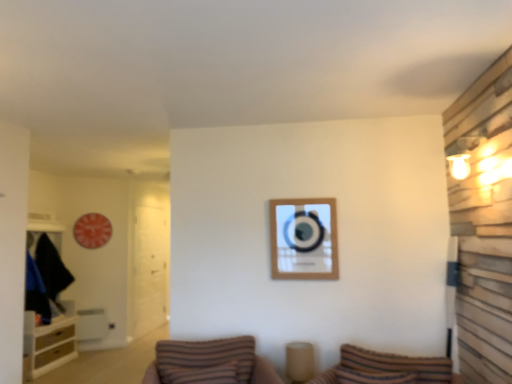
Question: Does brown striped pillow at center have a greater width compared to striped fabric pillow at lower center?

Choices:
 (A) no
 (B) yes

Answer: (B)

Question: Is brown striped pillow at center to the right of striped fabric pillow at lower center from the viewer's perspective?

Choices:
 (A) yes
 (B) no

Answer: (B)

Question: Does brown striped pillow at center appear on the left side of striped fabric pillow at lower center?

Choices:
 (A) yes
 (B) no

Answer: (A)

Question: From a real-world perspective, is brown striped pillow at center physically above striped fabric pillow at lower center?

Choices:
 (A) no
 (B) yes

Answer: (A)

Question: Is brown striped pillow at center positioned with its back to striped fabric pillow at lower center?

Choices:
 (A) yes
 (B) no

Answer: (B)

Question: Considering the positions of brown striped pillow at center and wooden picture frame at center in the image, is brown striped pillow at center wider or thinner than wooden picture frame at center?

Choices:
 (A) thin
 (B) wide

Answer: (B)

Question: In the image, is brown striped pillow at center positioned in front of or behind wooden picture frame at center?

Choices:
 (A) front
 (B) behind

Answer: (A)

Question: From a real-world perspective, is brown striped pillow at center positioned above or below wooden picture frame at center?

Choices:
 (A) below
 (B) above

Answer: (A)

Question: Considering the positions of brown striped pillow at center and wooden picture frame at center in the image, is brown striped pillow at center taller or shorter than wooden picture frame at center?

Choices:
 (A) short
 (B) tall

Answer: (A)

Question: Considering their positions, is wooden picture frame at center located in front of or behind transparent glass door at left?

Choices:
 (A) front
 (B) behind

Answer: (A)

Question: Is point (289, 200) closer or farther from the camera than point (162, 210)?

Choices:
 (A) farther
 (B) closer

Answer: (B)

Question: From a real-world perspective, is wooden picture frame at center physically located above or below transparent glass door at left?

Choices:
 (A) below
 (B) above

Answer: (B)

Question: In terms of height, does wooden picture frame at center look taller or shorter compared to transparent glass door at left?

Choices:
 (A) tall
 (B) short

Answer: (B)

Question: Considering the positions of striped fabric pillow at lower center and transparent glass door at left in the image, is striped fabric pillow at lower center bigger or smaller than transparent glass door at left?

Choices:
 (A) small
 (B) big

Answer: (A)

Question: Considering the relative positions of striped fabric pillow at lower center and transparent glass door at left in the image provided, is striped fabric pillow at lower center to the left or to the right of transparent glass door at left?

Choices:
 (A) left
 (B) right

Answer: (B)